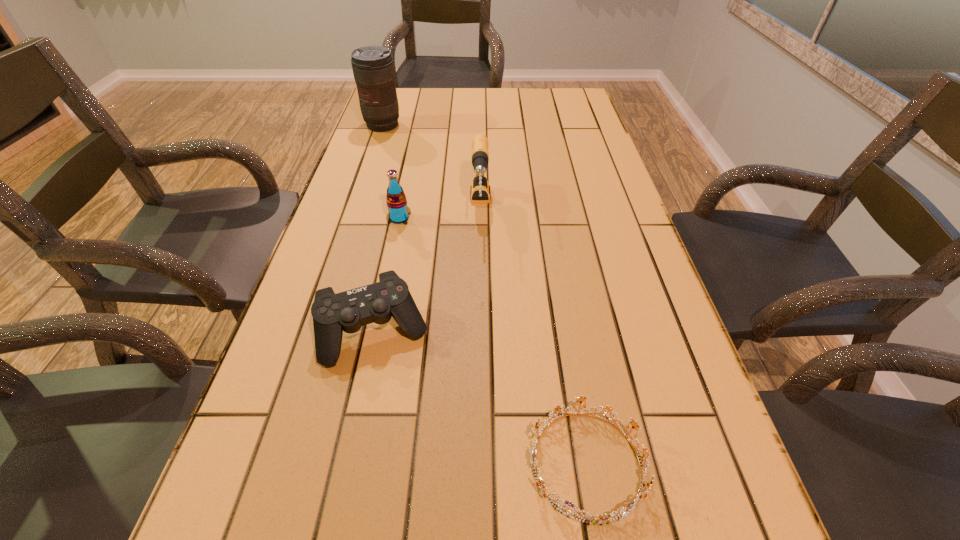
This screenshot has height=540, width=960. I want to click on vacant position at the far right corner of the desktop, so click(582, 91).

The image size is (960, 540). What are the coordinates of `vacant area that lies between the drill and the second nearest object` in the screenshot? It's located at [428, 270].

The width and height of the screenshot is (960, 540). In order to click on empty space between the telephoto lens and the drill in this screenshot , I will do click(431, 167).

Where is `free space that is in between the drill and the fourth farthest object`? free space that is in between the drill and the fourth farthest object is located at coordinates (428, 270).

Find the location of a particular element. The height and width of the screenshot is (540, 960). free point between the fourth tallest object and the drill is located at coordinates (428, 270).

At what (x,y) coordinates should I click in order to perform the action: click on vacant area between the tallest object and the tiara. Please return your answer as a coordinate pair (x, y). Looking at the image, I should click on (485, 295).

In order to click on free space between the rightmost object and the telephoto lens in this screenshot , I will do `click(485, 295)`.

Find the location of `vacant point located between the fourth object from left to right and the soda`. vacant point located between the fourth object from left to right and the soda is located at coordinates 440,213.

Where is `vacant space that is in between the rightmost object and the soda`? vacant space that is in between the rightmost object and the soda is located at coordinates (493, 341).

Identify which object is the second closest to the soda. Please provide its 2D coordinates. Your answer should be formatted as a tuple, i.e. [(x, y)], where the tuple contains the x and y coordinates of a point satisfying the conditions above.

[(348, 311)]